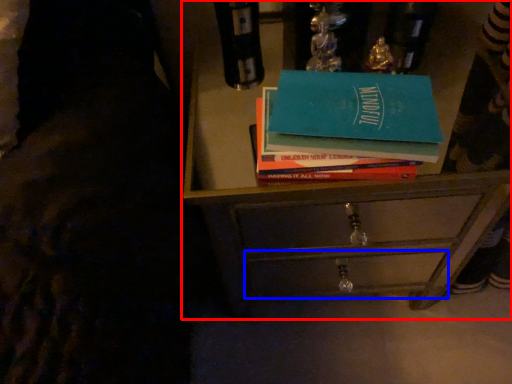
Question: Which of the following is the closest to the observer, chest of drawers (highlighted by a red box) or drawer (highlighted by a blue box)?

Choices:
 (A) chest of drawers
 (B) drawer

Answer: (A)